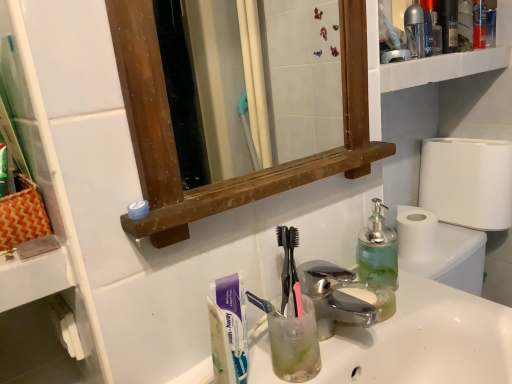
The width and height of the screenshot is (512, 384). I want to click on free space above white paper toilet roll at right (from a real-world perspective), so click(x=472, y=139).